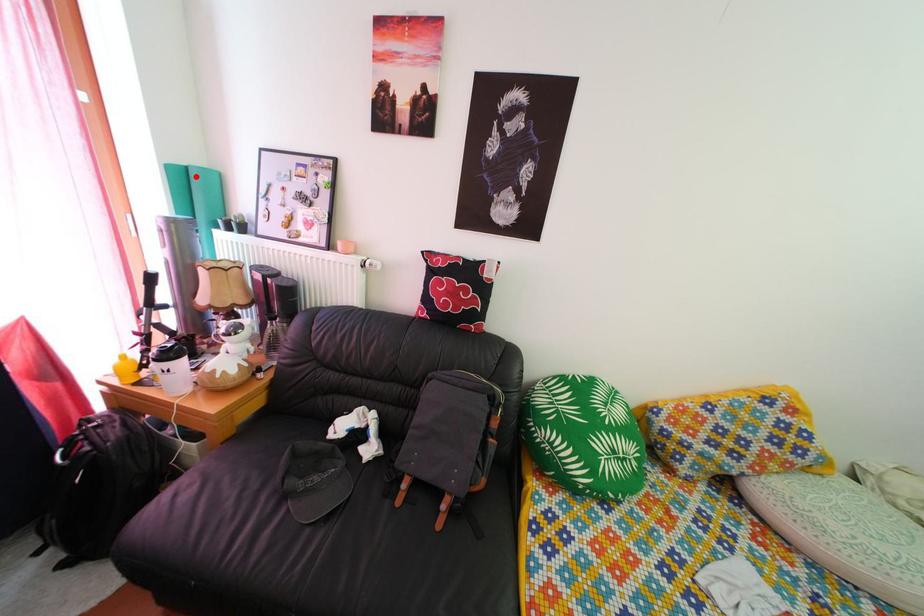
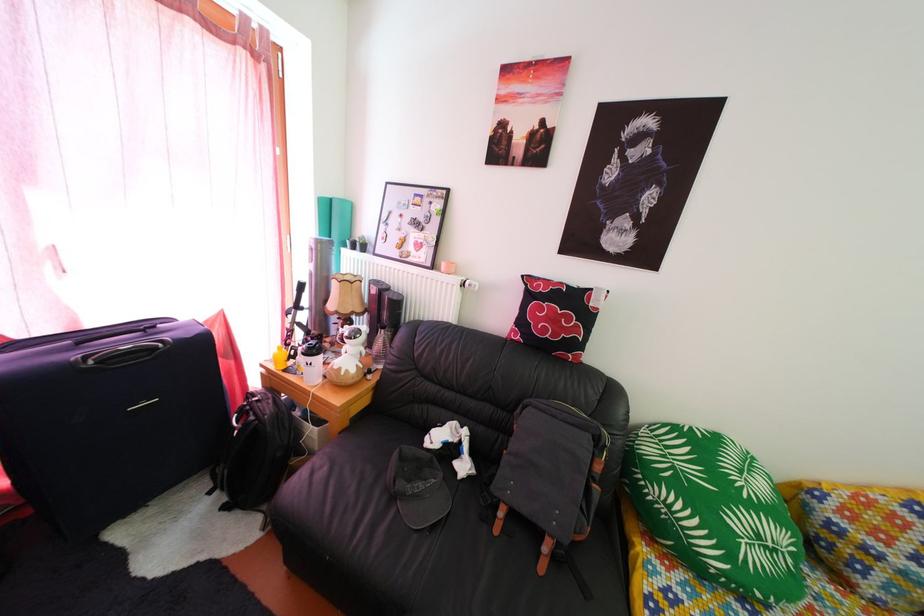
The point at the highlighted location is marked in the first image. Where is the corresponding point in the second image?

(339, 208)